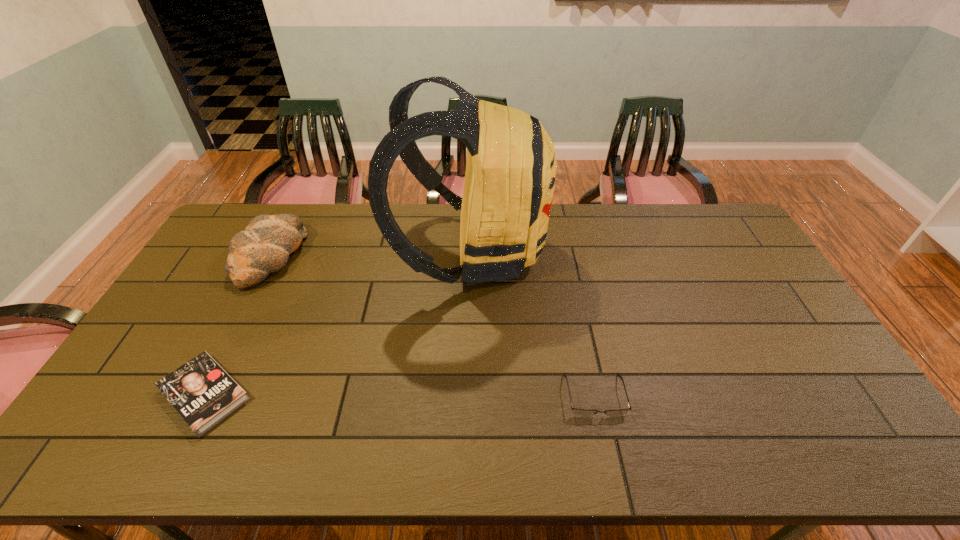
Where is `object that ranks as the third closest to the second shortest object`? Image resolution: width=960 pixels, height=540 pixels. object that ranks as the third closest to the second shortest object is located at coordinates (264, 247).

Locate an element on the screen. object that stands as the second closest to the book is located at coordinates (511, 166).

Where is `vacant region that satisfies the following two spatial constraints: 1. on the front side of the third shortest object; 2. on the left side of the shortest object`? vacant region that satisfies the following two spatial constraints: 1. on the front side of the third shortest object; 2. on the left side of the shortest object is located at coordinates (199, 394).